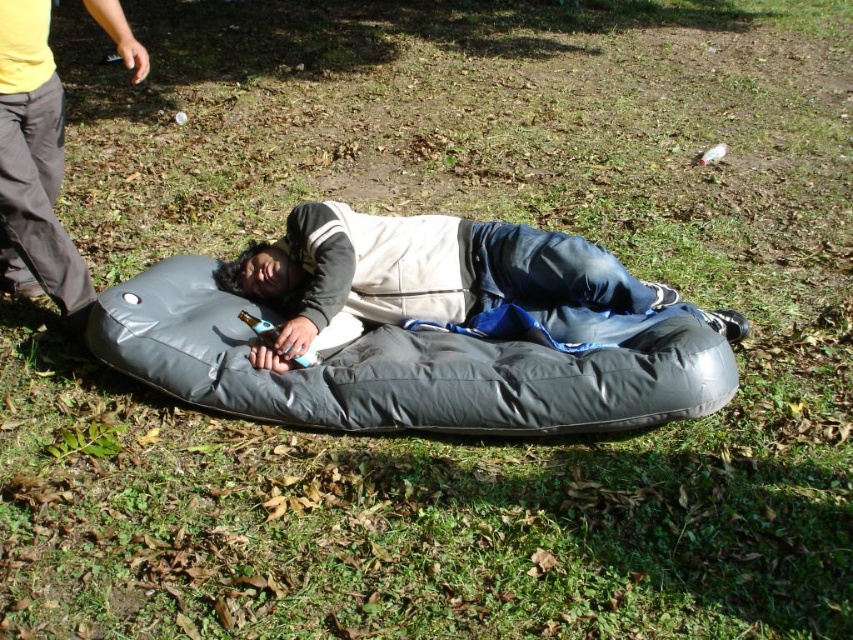
Between gray fabric bean bag chair at center and matte black inflatable at left, which one is positioned lower?

gray fabric bean bag chair at center is lower down.

Between gray fabric bean bag chair at center and matte black inflatable at left, which one is positioned higher?

matte black inflatable at left

Locate an element on the screen. gray fabric bean bag chair at center is located at coordinates (403, 369).

Locate an element on the screen. Image resolution: width=853 pixels, height=640 pixels. gray fabric bean bag chair at center is located at coordinates (403, 369).

Does point (259, 401) come in front of point (369, 316)?

Yes.

Who is shorter, gray fabric bean bag chair at center or matte gray sleeping bag at center?

gray fabric bean bag chair at center is shorter.

Between point (346, 396) and point (474, 301), which one is positioned behind?

The point (474, 301) is more distant.

I want to click on gray fabric bean bag chair at center, so click(x=403, y=369).

Looking at this image, which is above, matte gray sleeping bag at center or matte black inflatable at left?

matte black inflatable at left

Who is more distant from viewer, (286, 362) or (32, 225)?

The point (32, 225) is more distant.

The image size is (853, 640). Find the location of `matte gray sleeping bag at center`. matte gray sleeping bag at center is located at coordinates (445, 284).

The height and width of the screenshot is (640, 853). Find the location of `matte gray sleeping bag at center`. matte gray sleeping bag at center is located at coordinates [x=445, y=284].